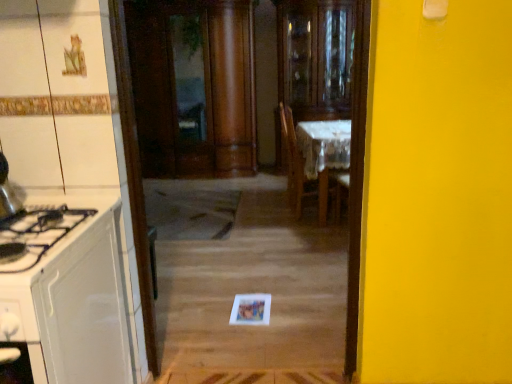
Question: Is transparent glass cabinet at center aimed at white glossy cabinet at left?

Choices:
 (A) yes
 (B) no

Answer: (A)

Question: Does transparent glass cabinet at center have a smaller size compared to white glossy cabinet at left?

Choices:
 (A) yes
 (B) no

Answer: (B)

Question: Can we say transparent glass cabinet at center lies outside white glossy cabinet at left?

Choices:
 (A) no
 (B) yes

Answer: (B)

Question: Is transparent glass cabinet at center touching white glossy cabinet at left?

Choices:
 (A) no
 (B) yes

Answer: (A)

Question: Does transparent glass cabinet at center have a lesser height compared to white glossy cabinet at left?

Choices:
 (A) no
 (B) yes

Answer: (A)

Question: Considering the positions of point (109, 236) and point (296, 31), is point (109, 236) closer or farther from the camera than point (296, 31)?

Choices:
 (A) closer
 (B) farther

Answer: (A)

Question: Relative to transparent glass cabinet at center, is white glossy cabinet at left in front or behind?

Choices:
 (A) front
 (B) behind

Answer: (A)

Question: From the image's perspective, relative to transparent glass cabinet at center, is white glossy cabinet at left above or below?

Choices:
 (A) below
 (B) above

Answer: (A)

Question: From their relative heights in the image, would you say white glossy cabinet at left is taller or shorter than transparent glass cabinet at center?

Choices:
 (A) tall
 (B) short

Answer: (B)

Question: From a real-world perspective, relative to white lace tablecloth at center, is transparent glass cabinet at center vertically above or below?

Choices:
 (A) above
 (B) below

Answer: (A)

Question: Is transparent glass cabinet at center to the left or to the right of white lace tablecloth at center in the image?

Choices:
 (A) right
 (B) left

Answer: (A)

Question: From the image's perspective, is transparent glass cabinet at center located above or below white lace tablecloth at center?

Choices:
 (A) below
 (B) above

Answer: (B)

Question: In terms of width, does transparent glass cabinet at center look wider or thinner when compared to white lace tablecloth at center?

Choices:
 (A) wide
 (B) thin

Answer: (A)

Question: From the image's perspective, is white lace tablecloth at center above or below white glossy cabinet at left?

Choices:
 (A) below
 (B) above

Answer: (B)

Question: Looking at their shapes, would you say white lace tablecloth at center is wider or thinner than white glossy cabinet at left?

Choices:
 (A) wide
 (B) thin

Answer: (B)